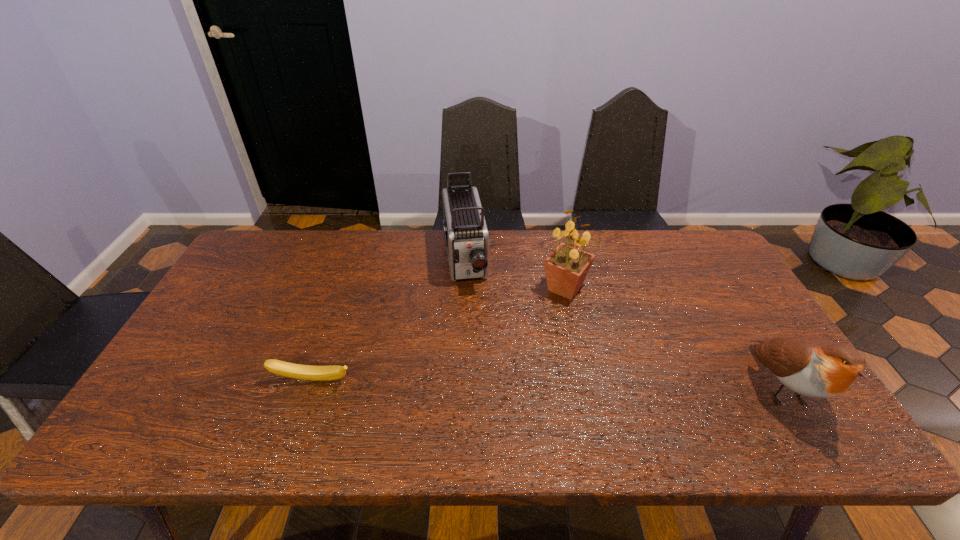
The height and width of the screenshot is (540, 960). Identify the location of empty space between the sunflower and the banana. (439, 334).

This screenshot has height=540, width=960. I want to click on vacant region between the leftmost object and the bird, so click(x=547, y=384).

Locate an element on the screen. vacant space that is in between the banana and the sunflower is located at coordinates (439, 334).

I want to click on object that is the third closest one to the shortest object, so click(816, 367).

Identify which object is located as the third nearest to the camcorder. Please provide its 2D coordinates. Your answer should be formatted as a tuple, i.e. [(x, y)], where the tuple contains the x and y coordinates of a point satisfying the conditions above.

[(816, 367)]